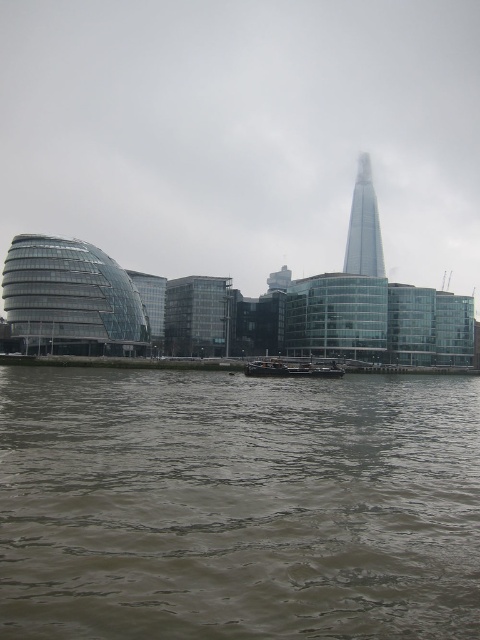
Question: Does brown murky water at lower center come in front of glassy skyscraper at upper right?

Choices:
 (A) no
 (B) yes

Answer: (B)

Question: Which of the following is the farthest from the observer?

Choices:
 (A) (360, 227)
 (B) (278, 164)
 (C) (323, 368)
 (D) (362, 509)

Answer: (B)

Question: Which of the following is the closest to the observer?

Choices:
 (A) transparent glass buildings at center
 (B) glassy skyscraper at upper right

Answer: (A)

Question: Can you confirm if glassy skyscraper at upper right is positioned to the left of dark gray metallic barge at center?

Choices:
 (A) no
 (B) yes

Answer: (A)

Question: Which object is farther from the camera taking this photo?

Choices:
 (A) brown murky water at lower center
 (B) glassy skyscraper at upper right
 (C) transparent glass buildings at center
 (D) dark gray metallic barge at center

Answer: (B)

Question: Does transparent glass buildings at center appear on the left side of dark gray metallic barge at center?

Choices:
 (A) yes
 (B) no

Answer: (A)